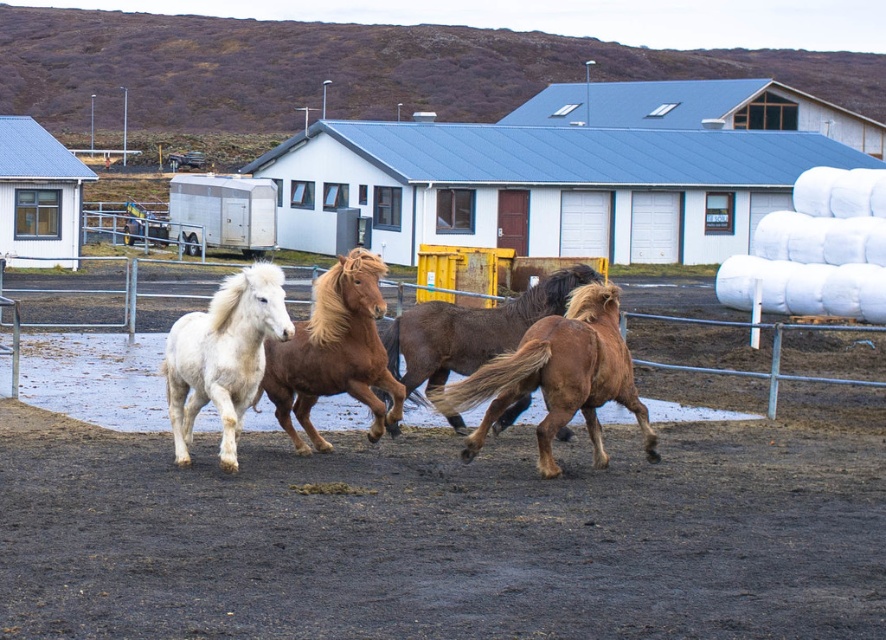
Question: Among these points, which one is farthest from the camera?

Choices:
 (A) (324, 316)
 (B) (804, 474)

Answer: (B)

Question: Which object appears closest to the camera in this image?

Choices:
 (A) brown glossy horse at center
 (B) damp brown dirt at center
 (C) brown silky horse at center

Answer: (B)

Question: Can you confirm if damp brown dirt at center is smaller than white fluffy horse at left?

Choices:
 (A) yes
 (B) no

Answer: (A)

Question: Is brown silky horse at center positioned in front of brown glossy horse at center?

Choices:
 (A) yes
 (B) no

Answer: (A)

Question: Does metallic silver fence at center lie behind brown silky horse at center?

Choices:
 (A) no
 (B) yes

Answer: (B)

Question: Which of the following is the farthest from the observer?

Choices:
 (A) (239, 317)
 (B) (514, 520)

Answer: (A)